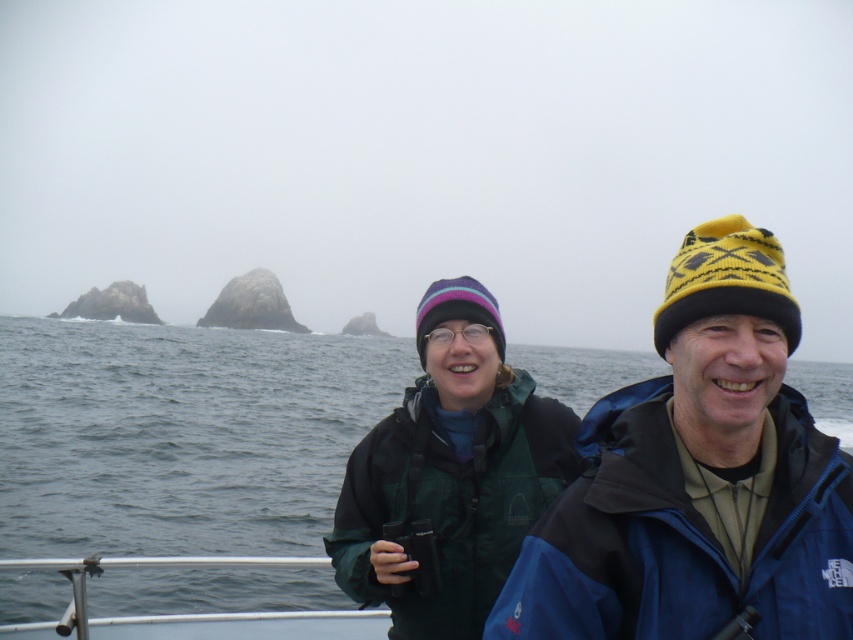
You are on a boat and need to hand a life jacket to someone. The gray water at center is below the green matte jacket at center. Where should you place the life jacket to keep it safe from the water?

You should place the life jacket above the gray water at center, since the green matte jacket at center is located above it and keeping it there would prevent it from getting wet.

You are on a boat and want to observe the distant rock formations. Which object, the gray water at center or the polished metal railing at lower left, would allow you to see the rocks more clearly?

The gray water at center is in front of the polished metal railing at lower left, so the gray water at center would provide a clearer view of the distant rock formations since it is not obstructed by the railing.